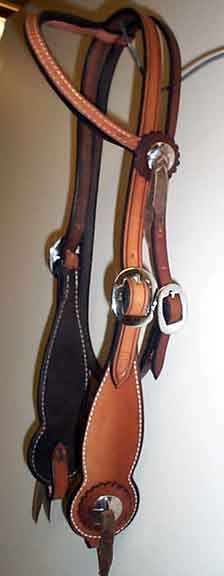
Find the location of a particular element. The height and width of the screenshot is (576, 224). mirror is located at coordinates (111, 505).